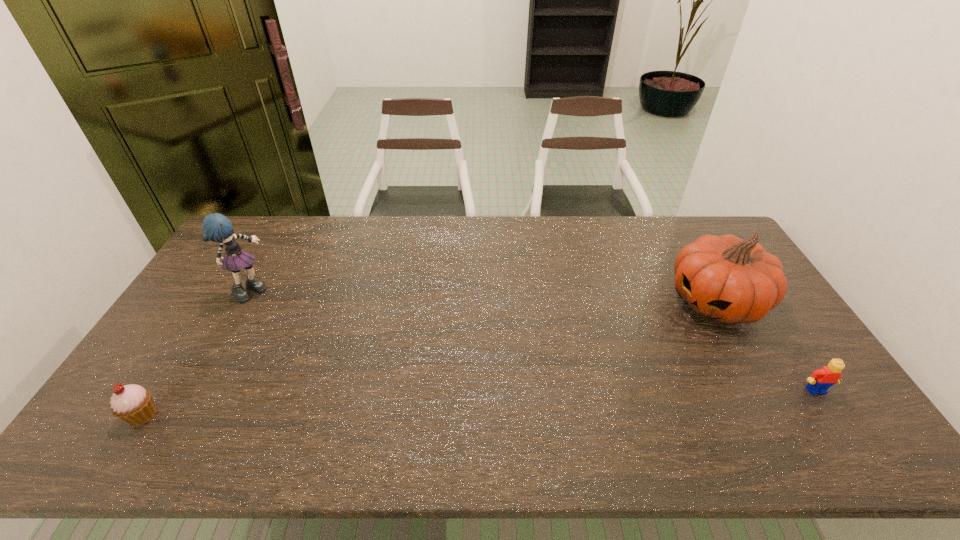
What are the coordinates of `the leftmost object` in the screenshot? It's located at (132, 403).

The height and width of the screenshot is (540, 960). What are the coordinates of `cupcake` in the screenshot? It's located at click(x=132, y=403).

Where is `Lego`? The width and height of the screenshot is (960, 540). Lego is located at coordinates (819, 382).

At what (x,y) coordinates should I click in order to perform the action: click on pumpkin. Please return your answer as a coordinate pair (x, y). Looking at the image, I should click on (730, 280).

Locate an element on the screen. This screenshot has width=960, height=540. the second object from left to right is located at coordinates (216, 227).

Identify the location of the tallest object. (216, 227).

Image resolution: width=960 pixels, height=540 pixels. Identify the location of vacant region located on the right of the leftmost object. (183, 415).

The image size is (960, 540). Identify the location of vacant space located 0.200m on the face of the pumpkin. (644, 354).

Image resolution: width=960 pixels, height=540 pixels. What are the coordinates of `free location located 0.260m on the face of the pumpkin` in the screenshot? It's located at (630, 364).

Where is `vacant space located on the face of the pumpkin`? vacant space located on the face of the pumpkin is located at coordinates (653, 347).